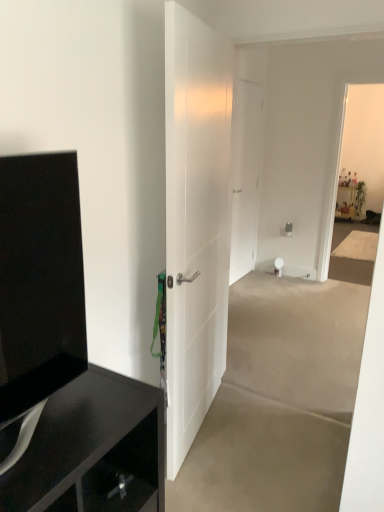
At what (x,y) coordinates should I click in order to perform the action: click on free space above black glossy cabinet at left (from a real-world perspective). Please return your answer as a coordinate pair (x, y). This screenshot has width=384, height=512. Looking at the image, I should click on (74, 412).